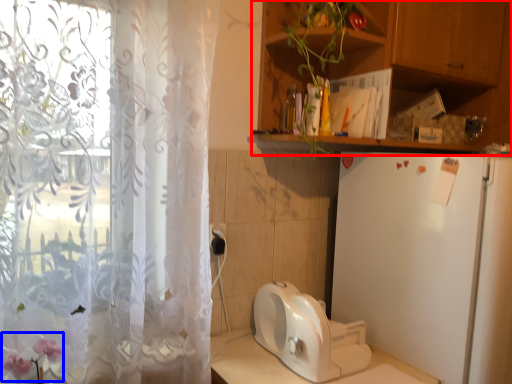
Question: Which object appears closest to the camera in this image, cabinetry (highlighted by a red box) or flower (highlighted by a blue box)?

Choices:
 (A) cabinetry
 (B) flower

Answer: (B)